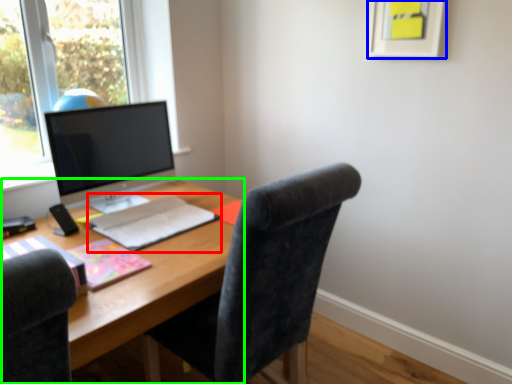
Question: Estimate the real-world distances between objects in this image. Which object is farther from notebook (highlighted by a red box), picture frame (highlighted by a blue box) or desk (highlighted by a green box)?

Choices:
 (A) picture frame
 (B) desk

Answer: (A)